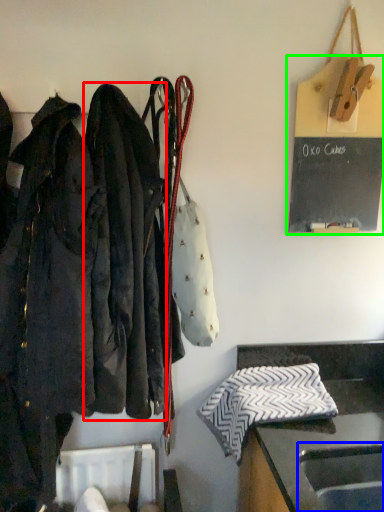
Question: Estimate the real-world distances between objects in this image. Which object is closer to jacket (highlighted by a red box), sink (highlighted by a blue box) or bulletin board (highlighted by a green box)?

Choices:
 (A) sink
 (B) bulletin board

Answer: (B)